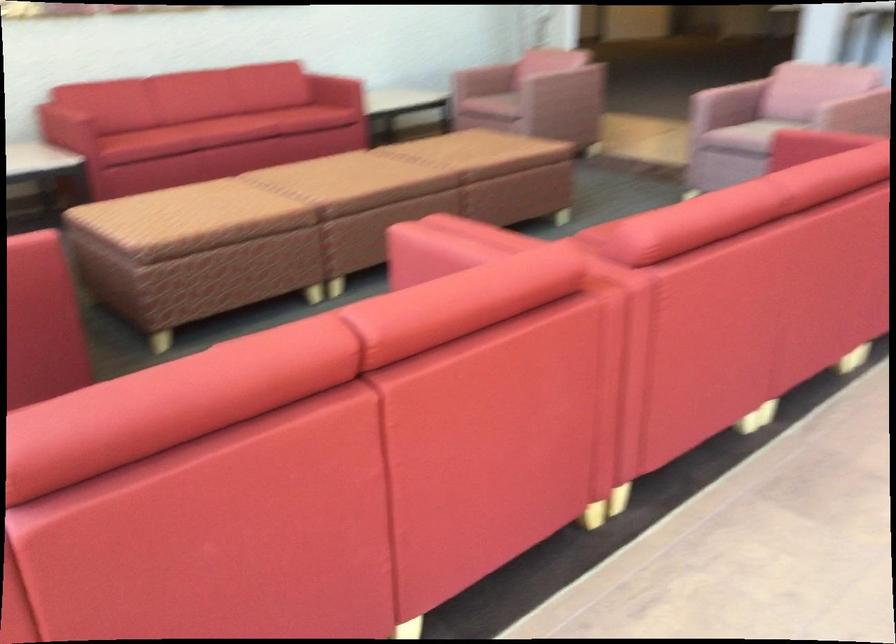
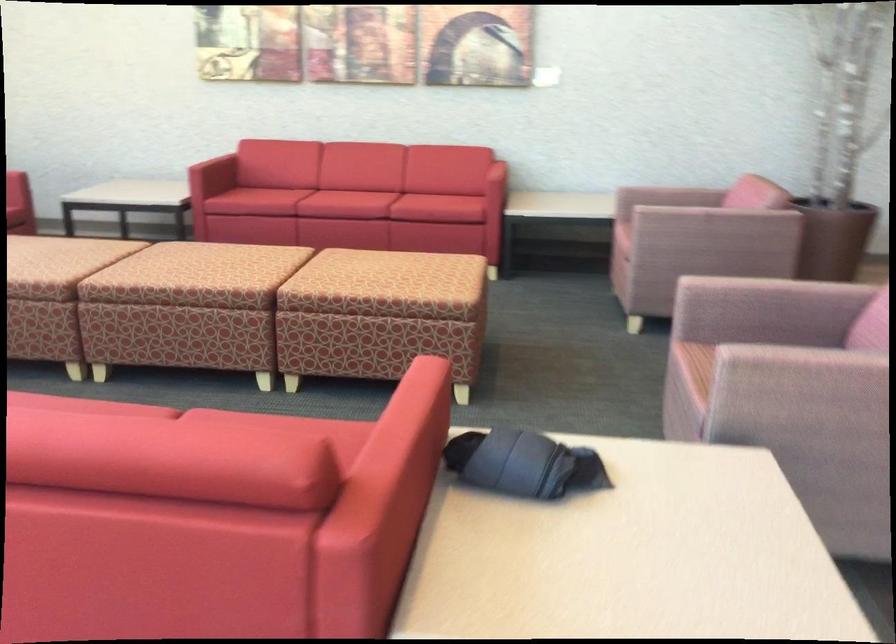
Where in the second image is the point corresponding to [181,154] from the first image?

(265, 200)